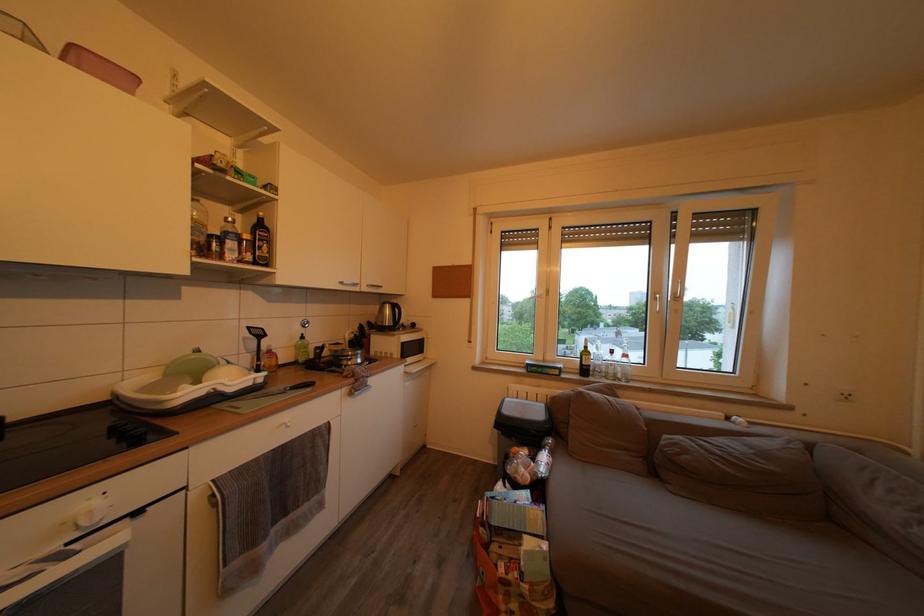
At what (x,y) coordinates should I click in order to perform the action: click on dark wine bottle. Please return your answer as a coordinate pair (x, y). The image size is (924, 616). Looking at the image, I should click on (261, 241).